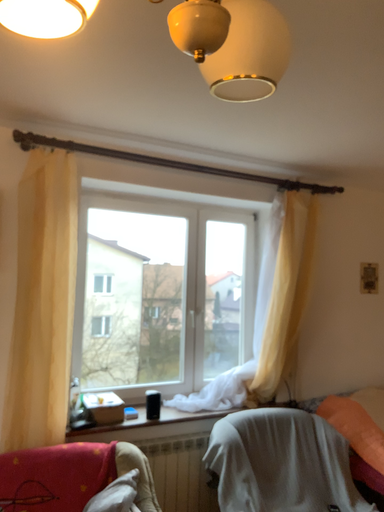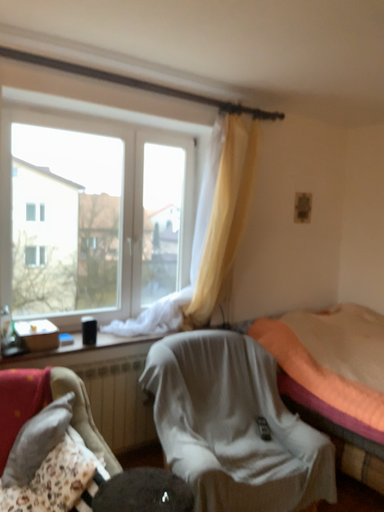
Question: Which way did the camera rotate in the video?

Choices:
 (A) rotated right
 (B) rotated left

Answer: (A)